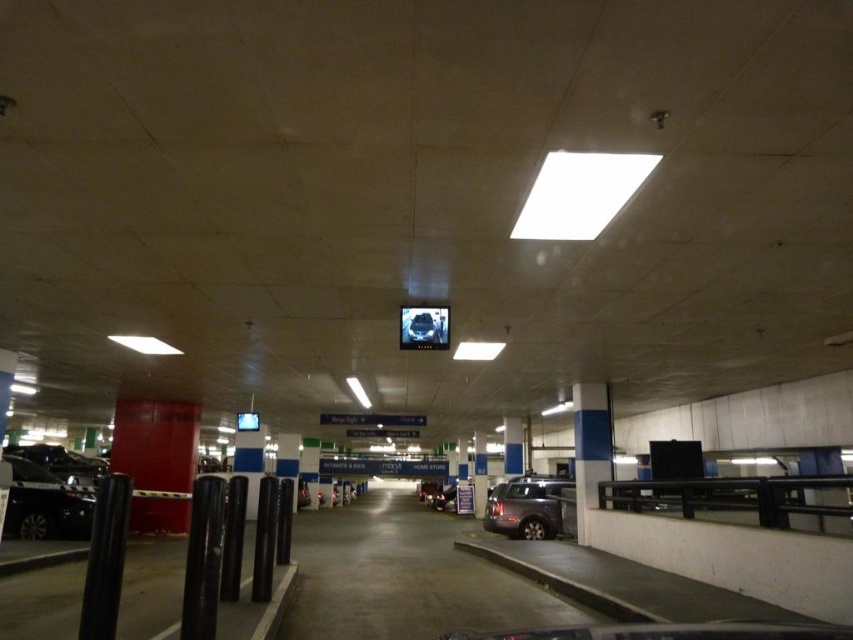
Between point (492, 493) and point (442, 504), which one is positioned in front?

Point (492, 493) is more forward.

Is point (515, 476) less distant than point (437, 499)?

Yes, it is in front of point (437, 499).

Identify the location of metallic silver suv at center. This screenshot has width=853, height=640. (526, 508).

The height and width of the screenshot is (640, 853). Identify the location of metallic silver suv at center. (526, 508).

Does shiny black car at lower left appear on the left side of metallic silver suv at center?

Yes, shiny black car at lower left is to the left of metallic silver suv at center.

From the picture: Who is taller, shiny black car at lower left or metallic silver suv at center?

shiny black car at lower left is taller.

Measure the distance between shiny black car at lower left and camera.

12.03 meters

The width and height of the screenshot is (853, 640). What are the coordinates of `shiny black car at lower left` in the screenshot? It's located at (45, 504).

Image resolution: width=853 pixels, height=640 pixels. Find the location of `shiny black car at lower left`. shiny black car at lower left is located at coordinates (45, 504).

Does shiny black car at lower left have a smaller size compared to metallic gray suv at center?

Correct, shiny black car at lower left occupies less space than metallic gray suv at center.

Who is more forward, (9, 532) or (440, 504)?

Point (9, 532)

The image size is (853, 640). I want to click on shiny black car at lower left, so click(x=45, y=504).